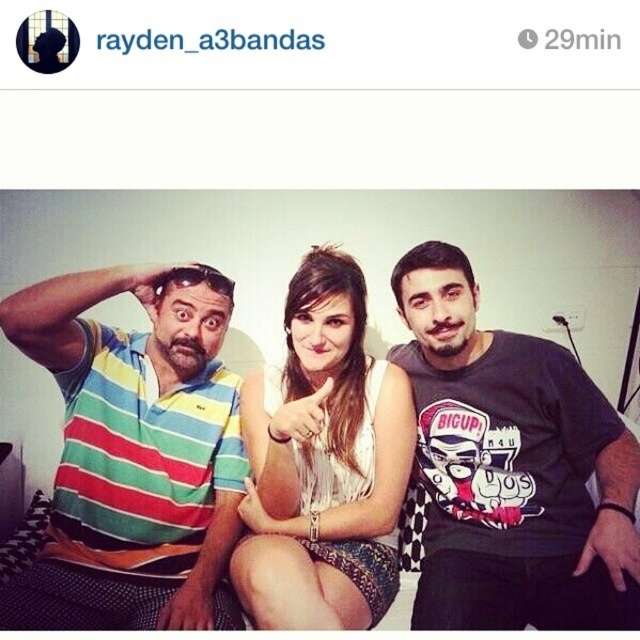
Question: Is striped polo shirt at left positioned at the back of white textured dress at center?

Choices:
 (A) no
 (B) yes

Answer: (B)

Question: Does black matte t-shirt at right appear on the right side of white textured dress at center?

Choices:
 (A) no
 (B) yes

Answer: (B)

Question: Can you confirm if striped polo shirt at left is wider than white textured dress at center?

Choices:
 (A) yes
 (B) no

Answer: (A)

Question: Which of the following is the closest to the observer?

Choices:
 (A) (228, 314)
 (B) (356, 316)

Answer: (B)

Question: Which of these objects is positioned farthest from the striped polo shirt at left?

Choices:
 (A) white textured dress at center
 (B) black matte t-shirt at right

Answer: (B)

Question: Which point is closer to the camera?

Choices:
 (A) (472, 513)
 (B) (76, 280)
 (C) (280, 563)

Answer: (C)